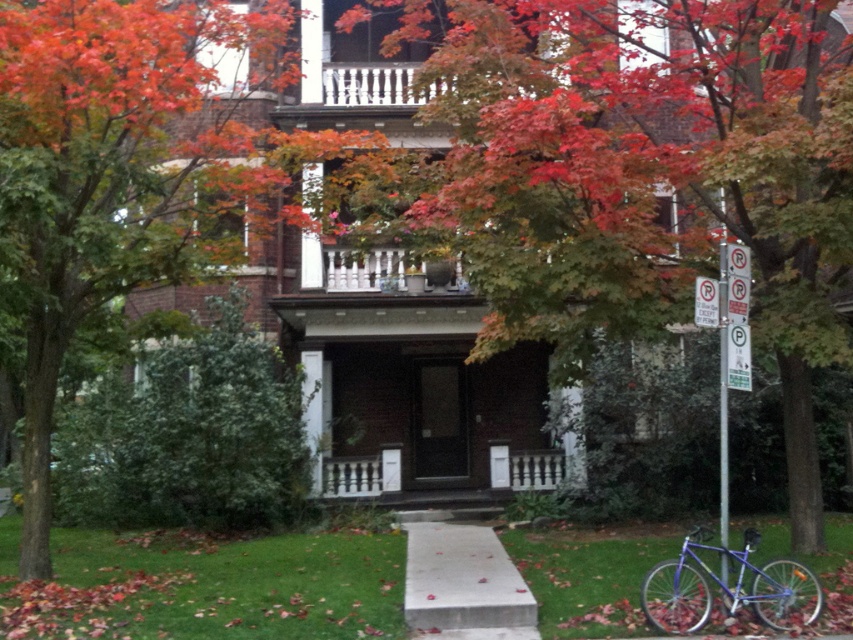
Find the location of a particular element. autumn leaves at center is located at coordinates (651, 173).

Between autumn leaves at center and green leafy tree at center, which one is positioned higher?

autumn leaves at center is above.

Which is behind, point (489, 173) or point (39, 524)?

Point (39, 524)

You are a GUI agent. You are given a task and a screenshot of the screen. Output one action in this format:
    pyautogui.click(x=<x>, y=<y>)
    Task: Click on the autumn leaves at center
    This screenshot has height=640, width=853.
    Given the screenshot: What is the action you would take?
    pyautogui.click(x=651, y=173)

Who is lower down, green leafy tree at center or white wooden porch at center?

Positioned lower is white wooden porch at center.

Between green leafy tree at center and white wooden porch at center, which one appears on the left side from the viewer's perspective?

Positioned to the left is green leafy tree at center.

The width and height of the screenshot is (853, 640). Describe the element at coordinates (120, 173) in the screenshot. I see `green leafy tree at center` at that location.

Find the location of a particular element. The image size is (853, 640). green leafy tree at center is located at coordinates (120, 173).

Who is more forward, [787,141] or [509,454]?

Positioned in front is point [787,141].

Is autumn leaves at center above white wooden porch at center?

Result: Correct, autumn leaves at center is located above white wooden porch at center.

The width and height of the screenshot is (853, 640). Find the location of `autumn leaves at center`. autumn leaves at center is located at coordinates tap(651, 173).